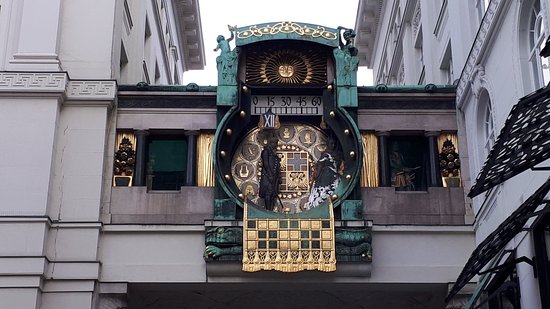
Where is `statue`? This screenshot has height=309, width=550. statue is located at coordinates (225, 43), (346, 43).